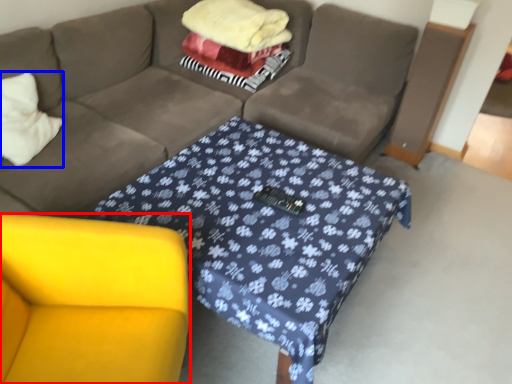
Question: Among these objects, which one is nearest to the camera, armchair (highlighted by a red box) or throw pillow (highlighted by a blue box)?

Choices:
 (A) armchair
 (B) throw pillow

Answer: (A)